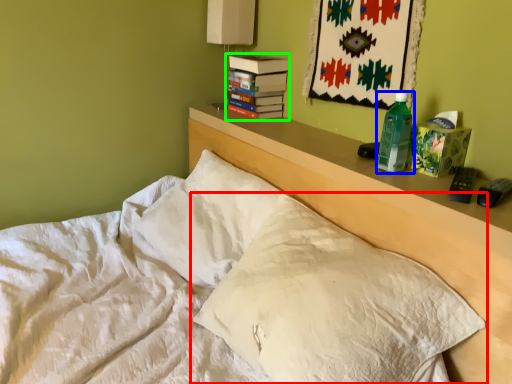
Question: Which object is the farthest from pillow (highlighted by a red box)? Choose among these: bottle (highlighted by a blue box) or paperback book (highlighted by a green box).

Choices:
 (A) bottle
 (B) paperback book

Answer: (B)